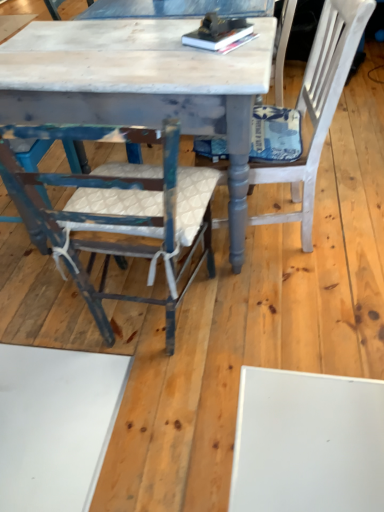
Question: Should I look upward or downward to see white textured cushion at right, which is the second chair from left to right?

Choices:
 (A) down
 (B) up

Answer: (B)

Question: Can you confirm if white textured cushion at right, the first chair positioned from the right, is positioned to the left of distressed blue wood chair at left, which is the first chair from left to right?

Choices:
 (A) yes
 (B) no

Answer: (B)

Question: Is white textured cushion at right, which is the second chair from left to right, touching distressed blue wood chair at left, which is the first chair from left to right?

Choices:
 (A) no
 (B) yes

Answer: (A)

Question: Is white textured cushion at right, which is the second chair from left to right, in front of distressed blue wood chair at left, which is the first chair from left to right?

Choices:
 (A) no
 (B) yes

Answer: (A)

Question: Is white textured cushion at right, which is the second chair from left to right, at the right side of distressed blue wood chair at left, which is the first chair from left to right?

Choices:
 (A) no
 (B) yes

Answer: (B)

Question: Is white textured cushion at right, the first chair positioned from the right, not near distressed blue wood chair at left, the second chair viewed from the right?

Choices:
 (A) yes
 (B) no

Answer: (B)

Question: Can you confirm if white textured cushion at right, which is the second chair from left to right, is smaller than distressed blue wood chair at left, which is the first chair from left to right?

Choices:
 (A) no
 (B) yes

Answer: (A)

Question: Is distressed white marble table at center located outside white textured cushion at right, which is the second chair from left to right?

Choices:
 (A) no
 (B) yes

Answer: (B)

Question: Does distressed white marble table at center appear on the right side of white textured cushion at right, the first chair positioned from the right?

Choices:
 (A) no
 (B) yes

Answer: (A)

Question: Is distressed white marble table at center far away from white textured cushion at right, the first chair positioned from the right?

Choices:
 (A) yes
 (B) no

Answer: (B)

Question: Is distressed white marble table at center smaller than white textured cushion at right, which is the second chair from left to right?

Choices:
 (A) yes
 (B) no

Answer: (B)

Question: Is distressed white marble table at center next to white textured cushion at right, the first chair positioned from the right?

Choices:
 (A) yes
 (B) no

Answer: (B)

Question: Considering the relative sizes of distressed white marble table at center and white textured cushion at right, which is the second chair from left to right, in the image provided, is distressed white marble table at center thinner than white textured cushion at right, which is the second chair from left to right,?

Choices:
 (A) yes
 (B) no

Answer: (B)

Question: Is white textured cushion at right, the first chair positioned from the right, positioned far away from hardcover books at center?

Choices:
 (A) yes
 (B) no

Answer: (B)